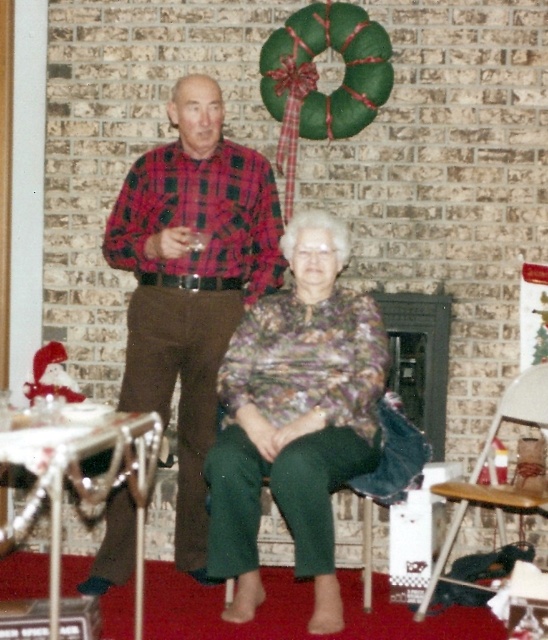
Based on the photo, you are standing near the camera and want to hand the plaid fabric shirt at center to someone across the room. Can you comfortably reach them without moving? The average human arm span is about 6 feet.

The plaid fabric shirt at center and camera are 11.49 feet apart, which is much farther than the average human arm span of 6 feet. You cannot comfortably reach them without moving.

You are a photographer setting up for a holiday photo shoot. You need to ensure that the printed fabric blouse at center is visible in the shot without being blocked by the wooden folding chair at lower right. Based on the scene description, can you confirm if the blouse will be visible?

The printed fabric blouse at center is in front of the wooden folding chair at lower right, so yes, the blouse will be visible and not blocked by the chair.